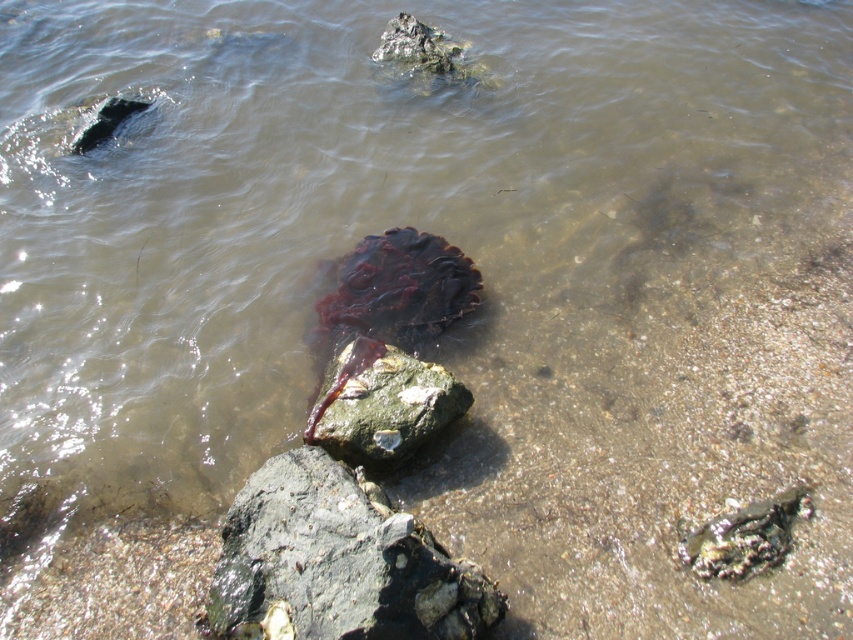
You are standing at the shoreline and want to pick up both the rough gray rock at center and the green mossy rock at center. Which rock should you reach for first to pick up the one closer to you?

The rough gray rock at center is closer to the viewer than the green mossy rock at center, so you should reach for the rough gray rock at center first.

You are standing at the shoreline and see the rough gray rock at center and the green mossy rock at center. Which rock is located to the left when facing the water?

The rough gray rock at center is positioned on the left side of green mossy rock at center, so it is located to the left when facing the water.

You are standing at the shoreline looking at the scene. There is a point marked at coordinates point (244, 538). If you want to reach that point without getting wet, what is the closest distance you can approach from your current position?

The point (244, 538) is 2.18 meters away from the viewer. Since the water is shallow and the point is at that distance, you can approach up to 2.18 meters from your current position to reach the point without getting wet, assuming the water depth is manageable.